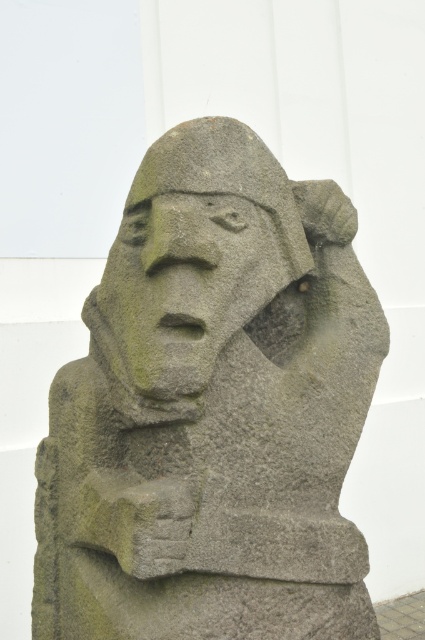
Does gray stone statue at center lie in front of green stone face at center?

Yes, it is in front of green stone face at center.

At what (x,y) coordinates should I click in order to perform the action: click on gray stone statue at center. Please return your answer as a coordinate pair (x, y). Looking at the image, I should click on (212, 410).

Does point (342, 376) lie behind point (107, 273)?

No, it is in front of (107, 273).

Identify the location of gray stone statue at center. This screenshot has height=640, width=425. (212, 410).